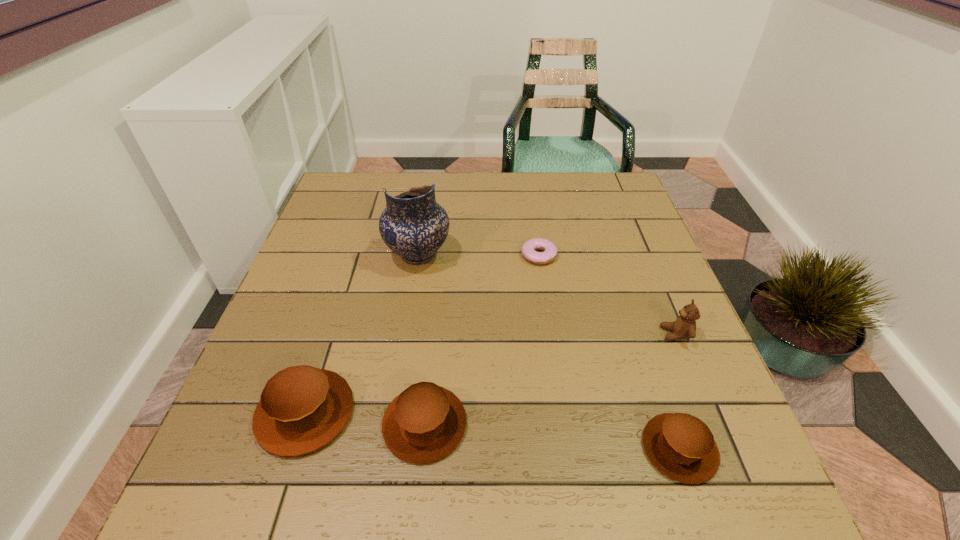
To achieve uniform spacing by inserting another muffin among them, please point to a free space for this new muffin. Please provide its 2D coordinates. Your answer should be formatted as a tuple, i.e. [(x, y)], where the tuple contains the x and y coordinates of a point satisfying the conditions above.

[(549, 436)]